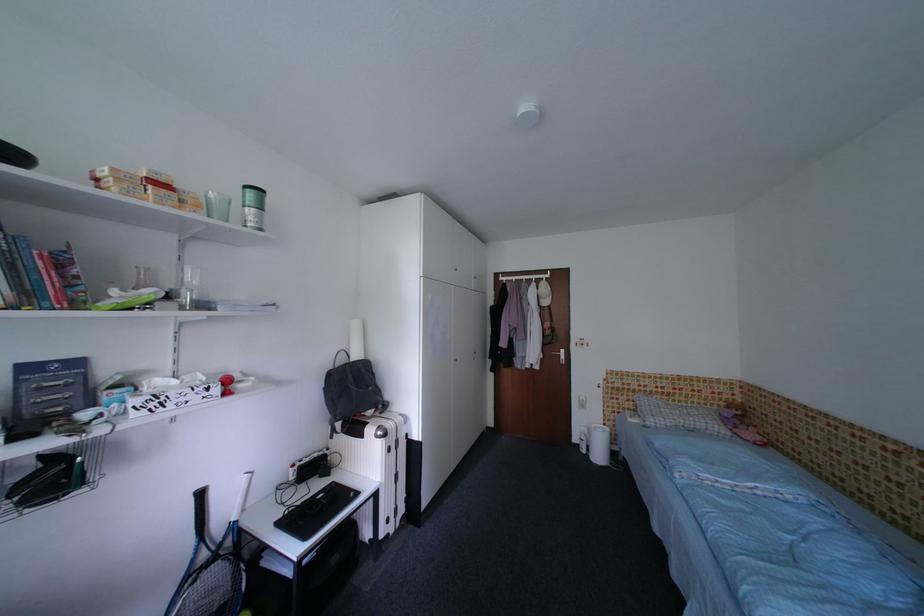
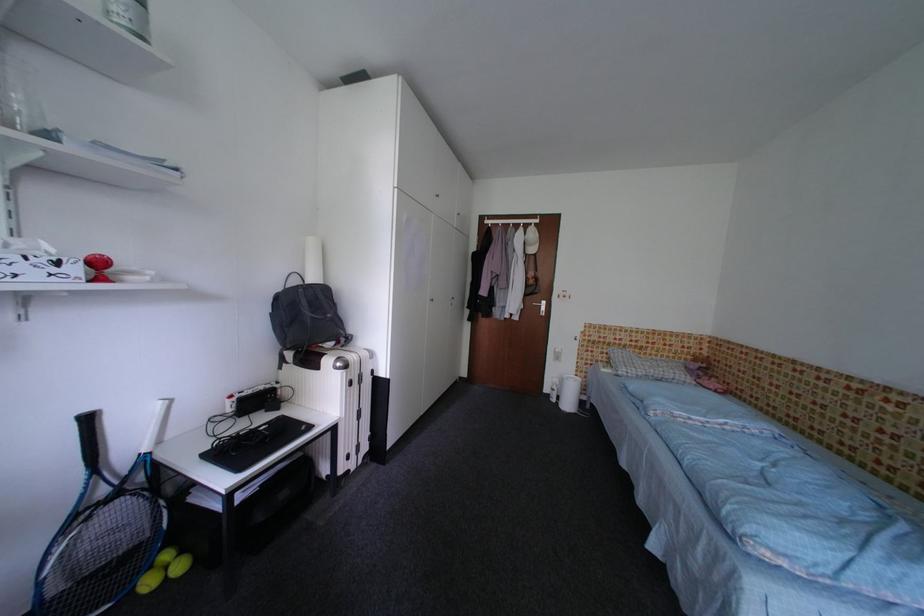
Question: I am providing you with two images of the same scene from different viewpoints. After the viewpoint changes to image2, which objects are now occluded?

Choices:
 (A) white suitcase
 (B) white cap
 (C) cabinet door handle
 (D) none of these

Answer: (D)